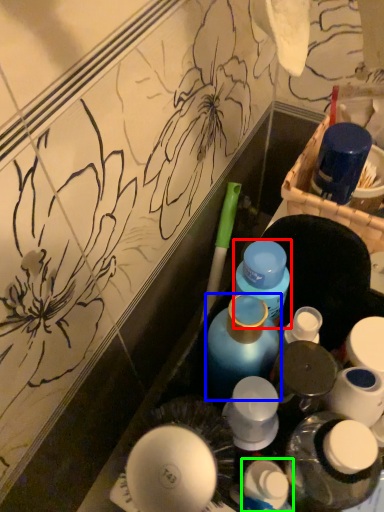
Question: Which object is positioned closest to bottle (highlighted by a red box)? Select from bottle (highlighted by a blue box) and toiletry (highlighted by a green box).

Choices:
 (A) bottle
 (B) toiletry

Answer: (A)